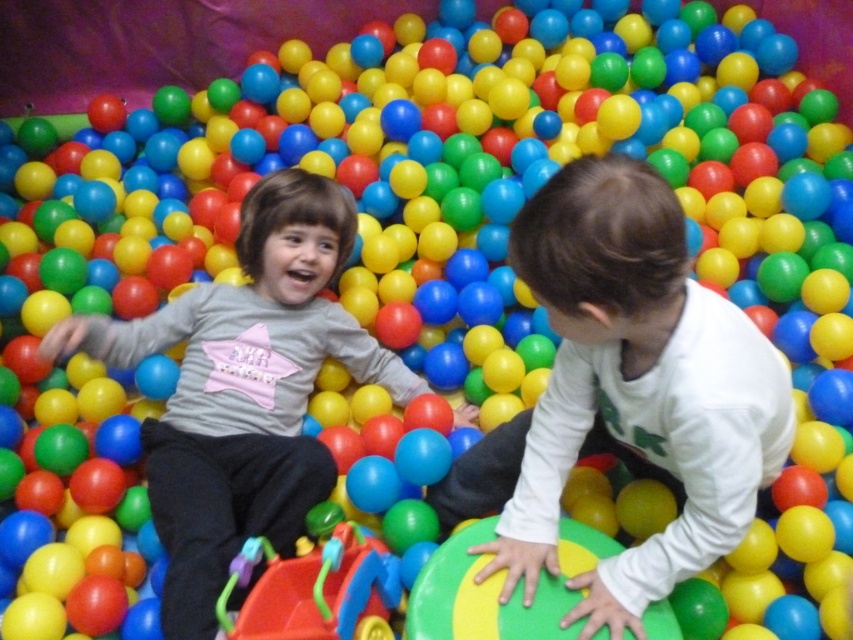
Which is more to the right, white matte shirt at center or matte gray shirt at center?

white matte shirt at center is more to the right.

Is the position of white matte shirt at center more distant than that of matte gray shirt at center?

No, white matte shirt at center is in front of matte gray shirt at center.

Where is `white matte shirt at center`? This screenshot has height=640, width=853. white matte shirt at center is located at coordinates [x=625, y=394].

Locate an element on the screen. white matte shirt at center is located at coordinates (625, 394).